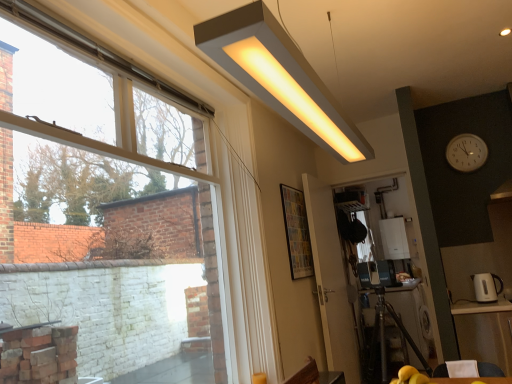
I want to click on free space above white plastic clock at upper right (from a real-world perspective), so click(464, 128).